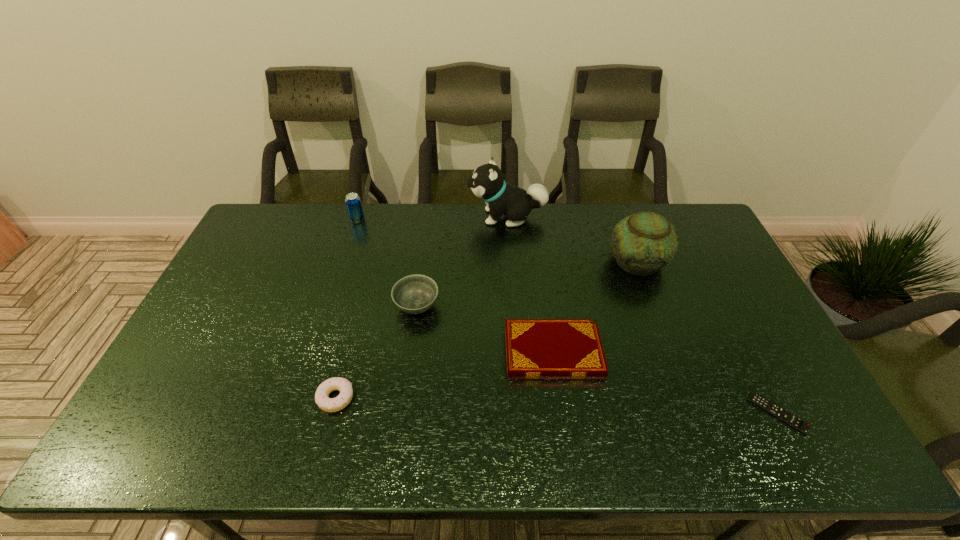
Where is `free space between the doughnut and the fifth shortest object`? free space between the doughnut and the fifth shortest object is located at coordinates (347, 308).

Identify which object is the second closest to the second object from right to left. Please provide its 2D coordinates. Your answer should be formatted as a tuple, i.e. [(x, y)], where the tuple contains the x and y coordinates of a point satisfying the conditions above.

[(535, 348)]

Point out which object is positioned as the nearest to the tallest object. Please provide its 2D coordinates. Your answer should be formatted as a tuple, i.e. [(x, y)], where the tuple contains the x and y coordinates of a point satisfying the conditions above.

[(644, 242)]

Locate an element on the screen. The height and width of the screenshot is (540, 960). vacant space that satisfies the following two spatial constraints: 1. on the cover of the hardback book; 2. on the back side of the shortest object is located at coordinates (562, 413).

The image size is (960, 540). In order to click on vacant space that satisfies the following two spatial constraints: 1. on the back side of the sixth shortest object; 2. on the left side of the fourth nearest object in this screenshot , I will do `click(422, 262)`.

I want to click on free location that satisfies the following two spatial constraints: 1. at the face of the second object from right to left; 2. on the left side of the puppy, so click(510, 262).